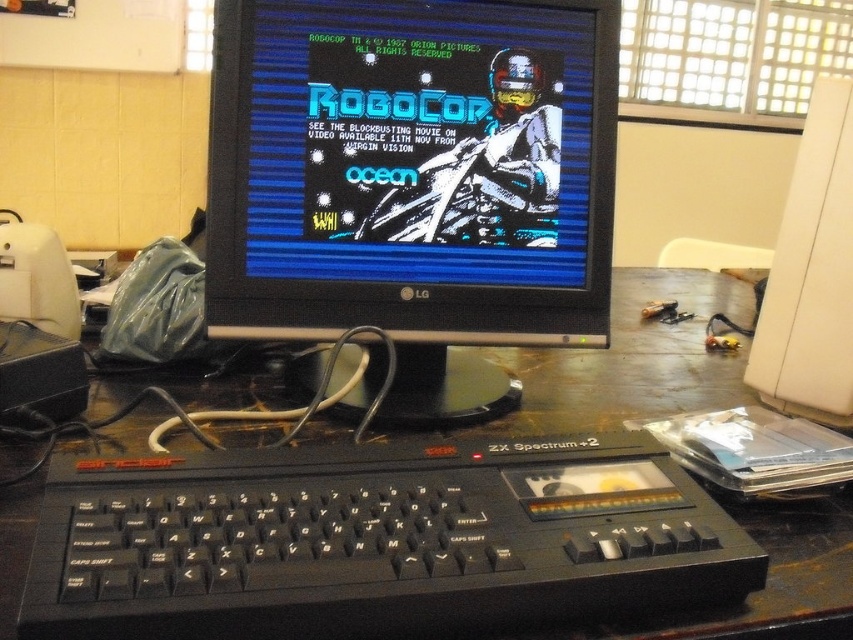
Does black plastic keyboard at lower center appear on the right side of black plastic computer desk at center?

No, black plastic keyboard at lower center is not to the right of black plastic computer desk at center.

The image size is (853, 640). I want to click on black plastic keyboard at lower center, so click(x=376, y=540).

Locate an element on the screen. The width and height of the screenshot is (853, 640). black plastic keyboard at lower center is located at coordinates (376, 540).

Which is behind, point (316, 564) or point (827, 380)?

Positioned behind is point (827, 380).

Where is `black plastic keyboard at lower center`? The image size is (853, 640). black plastic keyboard at lower center is located at coordinates (376, 540).

Does black plastic computer desk at center appear under white plastic monitor at right?

Correct, black plastic computer desk at center is located below white plastic monitor at right.

Which is in front, point (560, 428) or point (810, 195)?

Point (560, 428)

Does point (10, 525) come farther from viewer compared to point (842, 266)?

No, (10, 525) is in front of (842, 266).

Find the location of a particular element. black plastic computer desk at center is located at coordinates (633, 360).